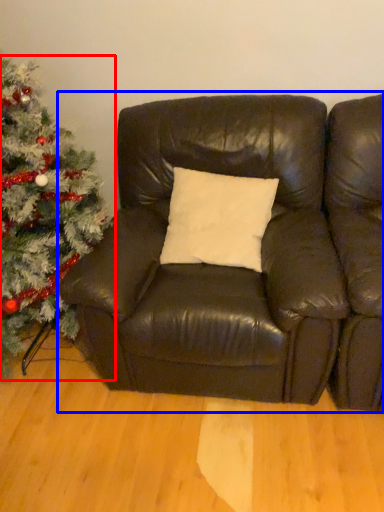
Question: Among these objects, which one is farthest to the camera, christmas tree (highlighted by a red box) or studio couch (highlighted by a blue box)?

Choices:
 (A) christmas tree
 (B) studio couch

Answer: (B)